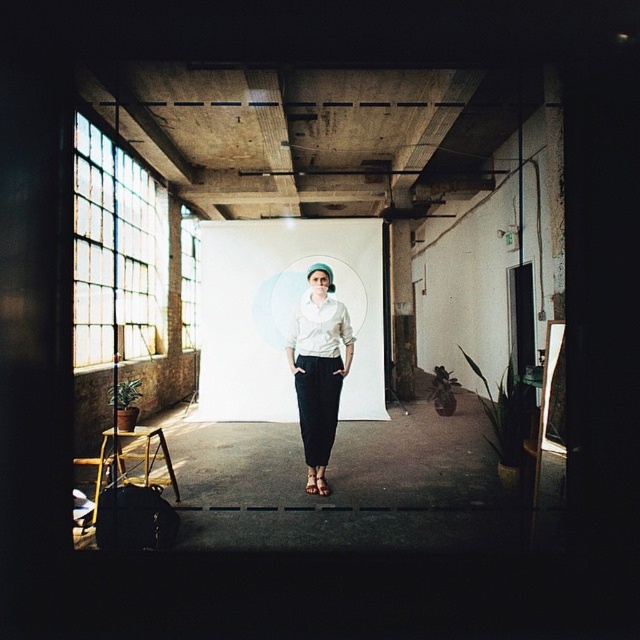
Based on the photo, you are standing in the industrial studio and want to take a photo of the person at the center. Which object, the white matte shirt at center or the brown leather sandal at center, should you focus on first to ensure it appears sharp in the photo?

The white matte shirt at center is further to the viewer than the brown leather sandal at center, so you should focus on the white matte shirt at center first to ensure it appears sharp in the photo.